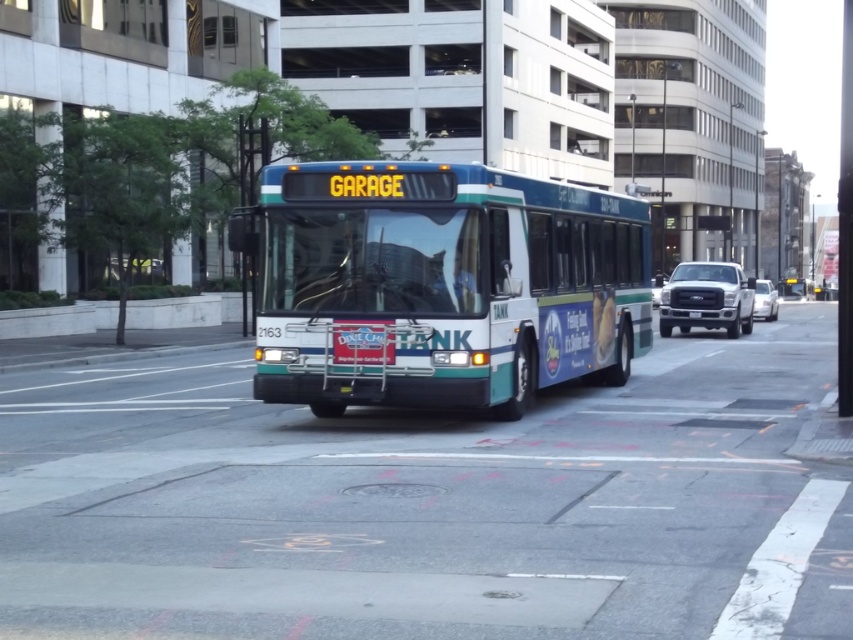
Question: Considering the relative positions of white matte truck at right and white glossy sedan at center in the image provided, where is white matte truck at right located with respect to white glossy sedan at center?

Choices:
 (A) left
 (B) right

Answer: (A)

Question: Can you confirm if teal glossy bus at center is thinner than white glossy sedan at center?

Choices:
 (A) yes
 (B) no

Answer: (A)

Question: Which object is closer to the camera taking this photo?

Choices:
 (A) white plastic license plate at center
 (B) teal glossy bus at center
 (C) white matte truck at right
 (D) white glossy sedan at center

Answer: (B)

Question: Is white matte truck at right above white glossy sedan at center?

Choices:
 (A) yes
 (B) no

Answer: (A)

Question: Estimate the real-world distances between objects in this image. Which object is farther from the white plastic license plate at center?

Choices:
 (A) teal glossy bus at center
 (B) white glossy sedan at center
 (C) white matte truck at right

Answer: (A)

Question: Which point appears farthest from the camera in this image?

Choices:
 (A) (769, 307)
 (B) (721, 294)

Answer: (A)